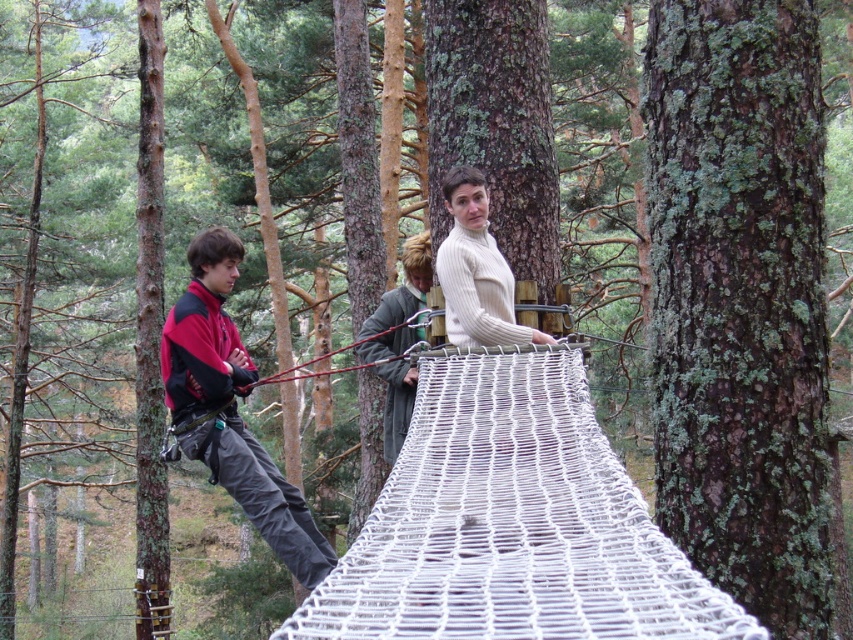
You are a hiker planning to cross the netted bridge. You see two people on the bridge, one wearing a red fleece jacket at left and another in a white ribbed sweater at center. Which person is standing higher up on the bridge?

The red fleece jacket at left is much taller than the white ribbed sweater at center, so the person in the red fleece jacket at left is standing higher up on the bridge.

You are a hiker planning to cross the netted bridge. You notice two people on the bridge wearing a red fleece jacket at left and a white ribbed sweater at center. If you want to pass between them, will there be enough space for you to walk through?

The red fleece jacket at left and white ribbed sweater at center are 4.26 feet apart from each other, so there is sufficient space for you to walk between them as 4.26 feet is more than enough for a person to pass through safely.

You are standing on the ground looking up at the netted bridge. Which object is closer to your left side, the brown rough bark at center or the red fleece jacket at left?

The red fleece jacket at left is closer to your left side because it is positioned to the left of the brown rough bark at center.